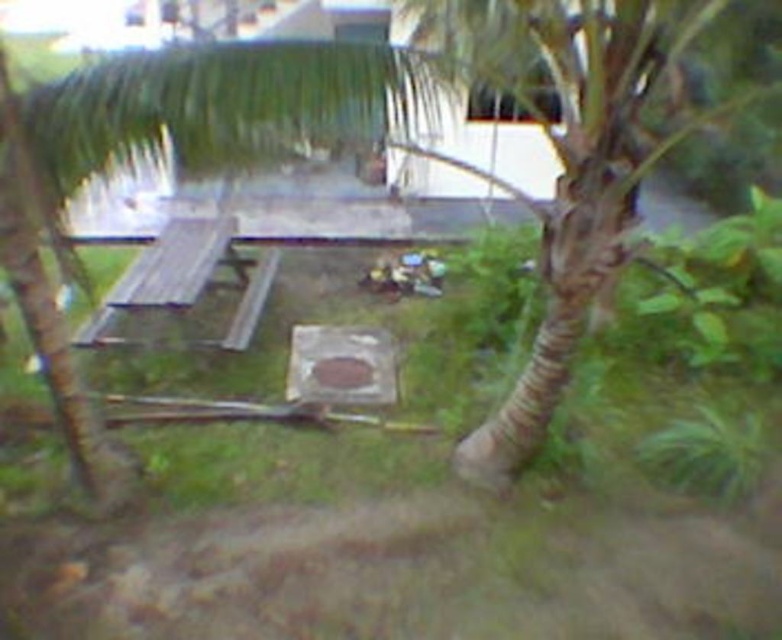
Based on the scene described, what is located at the coordinates point (336,323)?

The coordinates point (336,323) is occupied by green grass at center.

You are standing at the edge of the garden and see both the green grass at center and the wooden picnic table at center. Which object is positioned more to the right side of the scene?

The green grass at center is positioned to the right of the wooden picnic table at center, so it is more to the right side of the scene.